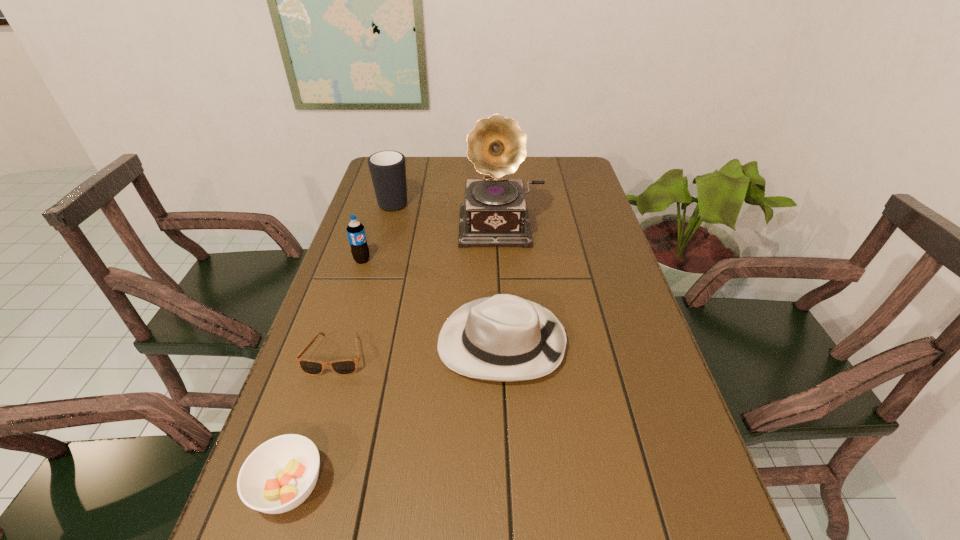
This screenshot has width=960, height=540. Find the location of `blank area located 0.220m on the side of the mug with the handle`. blank area located 0.220m on the side of the mug with the handle is located at coordinates (405, 160).

You are a GUI agent. You are given a task and a screenshot of the screen. Output one action in this format:
    pyautogui.click(x=<x>, y=<y>)
    Task: Click on the vacant area situated on the right of the fourth nearest object
    
    Given the screenshot: What is the action you would take?
    pyautogui.click(x=429, y=260)

Identify the location of free space located on the front-facing side of the fedora. The height and width of the screenshot is (540, 960). (373, 342).

Identify the location of vacant space located on the front-facing side of the fedora. The width and height of the screenshot is (960, 540). (412, 342).

Identify the location of free location located on the front-facing side of the fedora. (395, 342).

Identify the location of vacant space located on the back of the second shortest object. (314, 410).

Locate an element on the screen. vacant space situated 0.270m on the frames of the shortest object is located at coordinates (290, 503).

The image size is (960, 540). I want to click on mug that is at the left edge, so click(387, 168).

Identify the location of soda bottle situated at the left edge. (355, 230).

Locate an element on the screen. This screenshot has width=960, height=540. soup bowl that is positioned at the left edge is located at coordinates (280, 474).